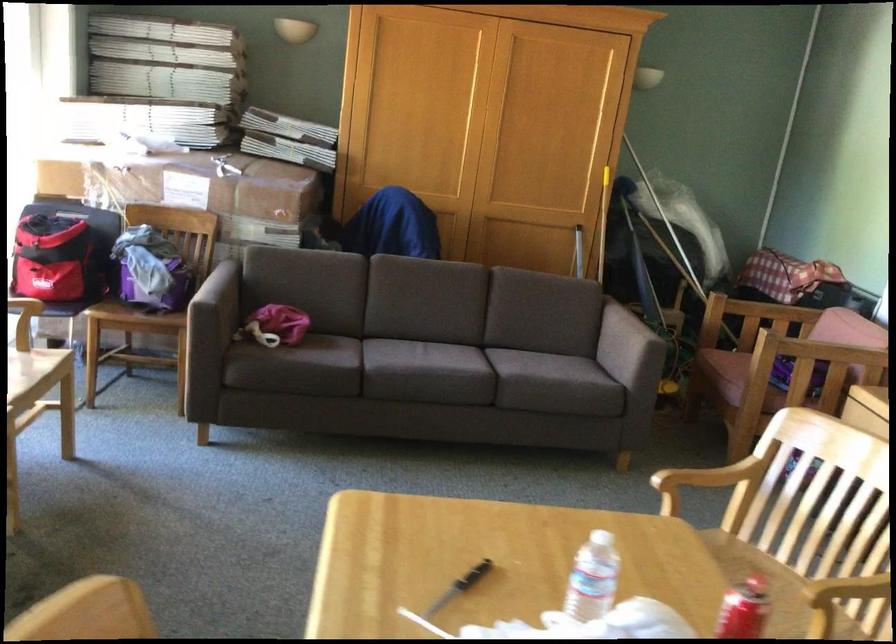
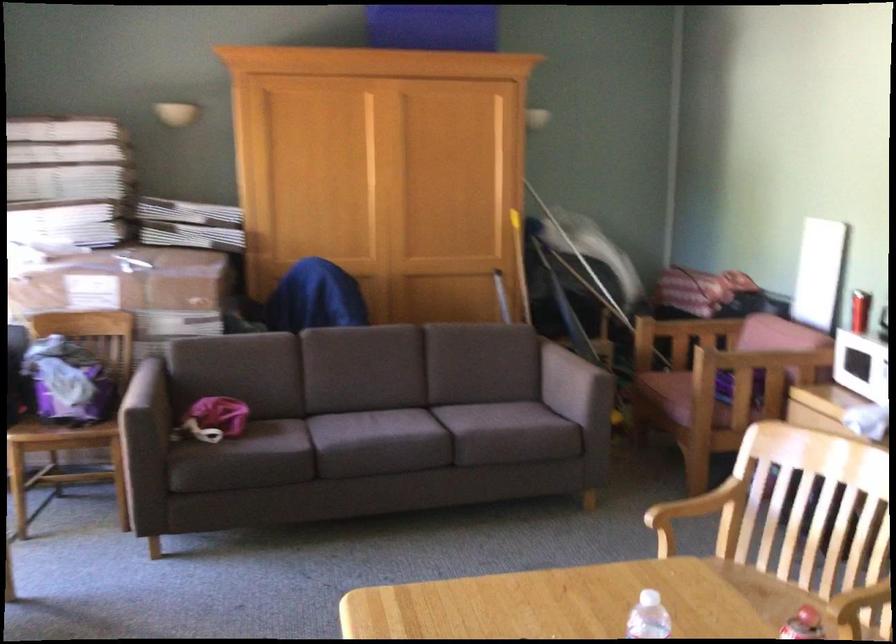
The images are taken continuously from a first-person perspective. In which direction are you moving?

The movement direction of the cameraman is left, forward.